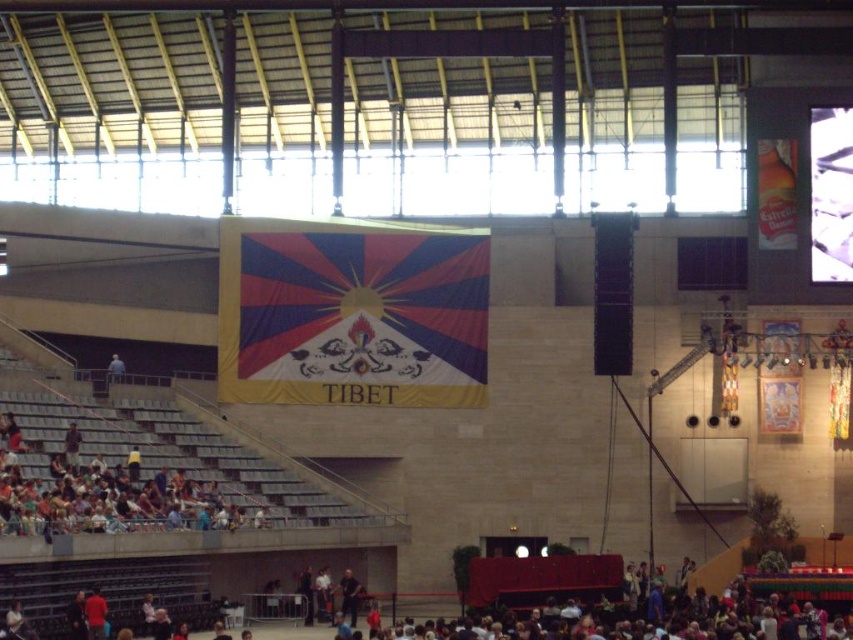
You are an event organizer trying to determine the best placement for a new banner. You notice two items in the arena image, the dark blue shirt at center and the blue fabric at upper center. Which of these two items has a smaller width?

The dark blue shirt at center has a lesser width compared to the blue fabric at upper center, so the dark blue shirt at center is smaller in width.

You are an event organizer standing at the front of the arena. You need to determine the best position to place a new speaker system so that it can be seen by both the dark blue shirt at lower left and the blue fabric at upper center. Which object should you use as a reference point to ensure visibility?

You should use the dark blue shirt at lower left as a reference point because it is closer to the viewer than the blue fabric at upper center, ensuring the speaker system is positioned where both objects can see it.